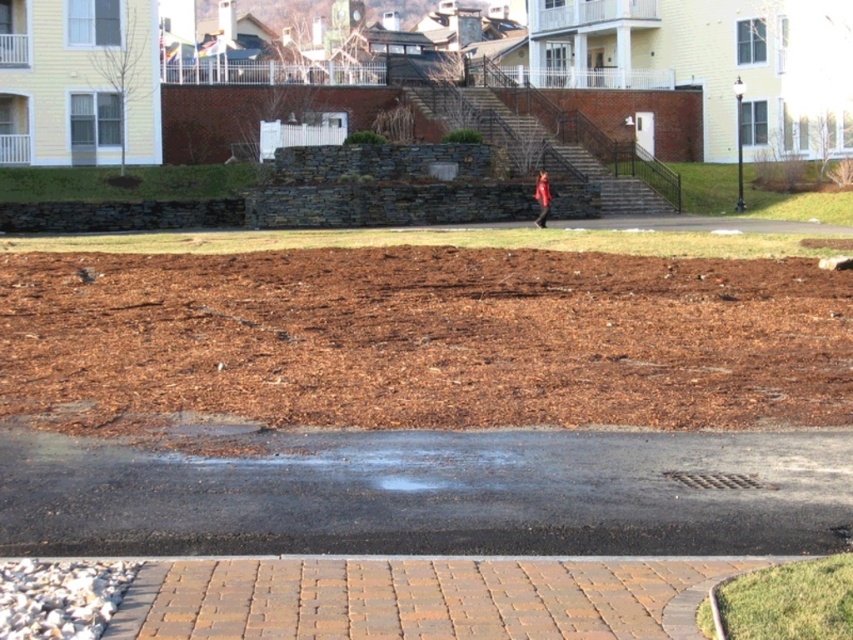
Question: Which object is positioned closest to the red fabric person at center?

Choices:
 (A) brown mulch at center
 (B) black asphalt at lower center
 (C) brown stone stairs at center

Answer: (C)

Question: Which object is closer to the camera taking this photo?

Choices:
 (A) red fabric person at center
 (B) brown stone stairs at center

Answer: (A)

Question: Which of the following is the farthest from the observer?

Choices:
 (A) (532, 493)
 (B) (381, 294)

Answer: (B)

Question: In this image, where is black asphalt at lower center located relative to red fabric person at center?

Choices:
 (A) below
 (B) above

Answer: (A)

Question: In this image, where is brown stone stairs at center located relative to red fabric person at center?

Choices:
 (A) above
 (B) below

Answer: (A)

Question: Does brown mulch at center appear on the right side of red fabric person at center?

Choices:
 (A) no
 (B) yes

Answer: (A)